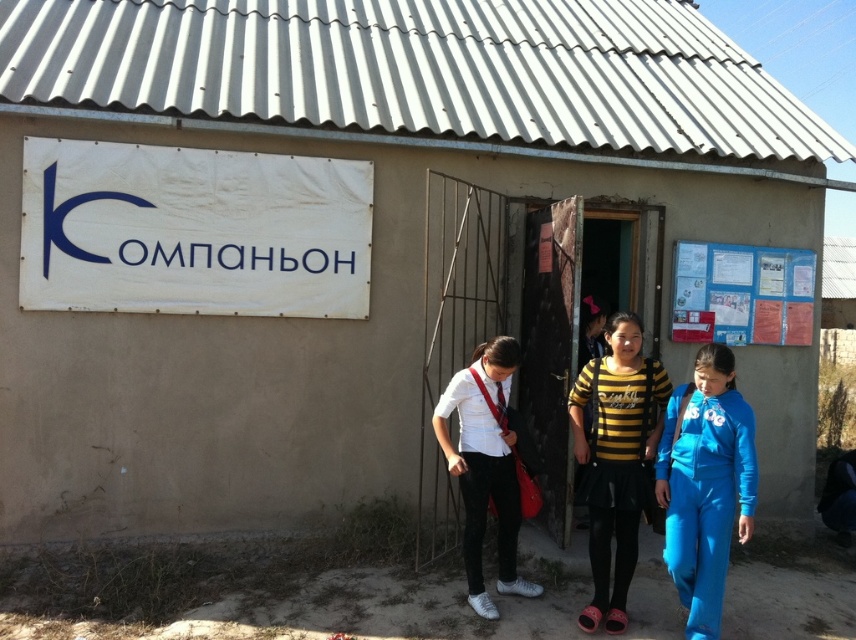
Can you confirm if blue fleece tracksuit at lower right is wider than blue paperboard at upper right?

In fact, blue fleece tracksuit at lower right might be narrower than blue paperboard at upper right.

This screenshot has height=640, width=856. Find the location of `blue fleece tracksuit at lower right`. blue fleece tracksuit at lower right is located at coordinates (705, 484).

Is point (625, 445) positioned behind point (752, 269)?

No, (625, 445) is closer to viewer.

Where is `yellow black striped shirt at center`? yellow black striped shirt at center is located at coordinates (616, 460).

The height and width of the screenshot is (640, 856). I want to click on yellow black striped shirt at center, so [616, 460].

Who is more distant from viewer, (290,312) or (635,499)?

Positioned behind is point (290,312).

Find the location of a particular element. white fabric sign at upper left is located at coordinates point(192,230).